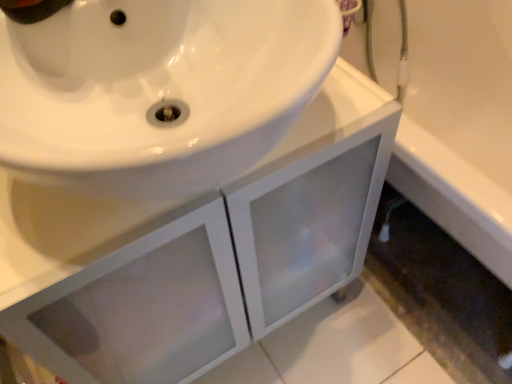
Question: From a real-world perspective, is white glossy bathtub at lower right positioned above or below white frosted glass cabinet at center?

Choices:
 (A) below
 (B) above

Answer: (B)

Question: Looking at their shapes, would you say white glossy bathtub at lower right is wider or thinner than white frosted glass cabinet at center?

Choices:
 (A) thin
 (B) wide

Answer: (B)

Question: Is white glossy bathtub at lower right to the left or to the right of white frosted glass cabinet at center in the image?

Choices:
 (A) right
 (B) left

Answer: (A)

Question: From a real-world perspective, is white frosted glass cabinet at center physically located above or below white glossy bathtub at lower right?

Choices:
 (A) above
 (B) below

Answer: (B)

Question: From the image's perspective, is white frosted glass cabinet at center located above or below white glossy bathtub at lower right?

Choices:
 (A) above
 (B) below

Answer: (B)

Question: Considering the relative positions of white frosted glass cabinet at center and white glossy bathtub at lower right in the image provided, is white frosted glass cabinet at center to the left or to the right of white glossy bathtub at lower right?

Choices:
 (A) right
 (B) left

Answer: (B)

Question: In terms of height, does white frosted glass cabinet at center look taller or shorter compared to white glossy bathtub at lower right?

Choices:
 (A) tall
 (B) short

Answer: (A)